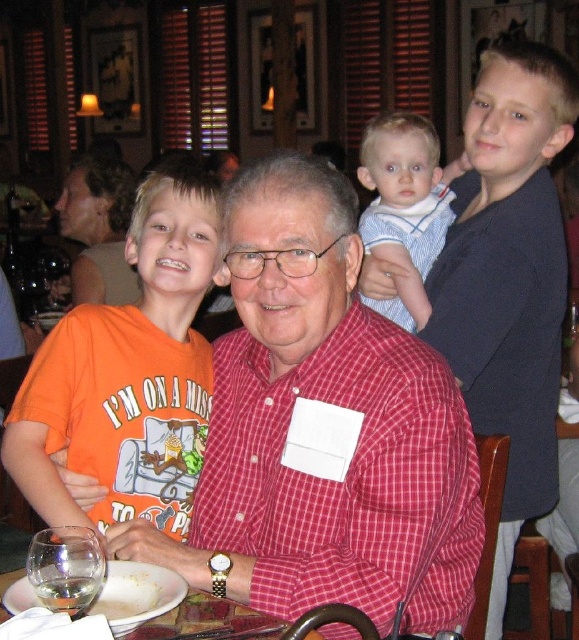
Is point (376, 141) positioned in front of point (53, 593)?

No.

Can you confirm if striped cotton shirt at upper center is wider than clear glass wine glass at lower left?

Yes, striped cotton shirt at upper center is wider than clear glass wine glass at lower left.

Between point (419, 170) and point (64, 602), which one is positioned behind?

The point (419, 170) is behind.

The height and width of the screenshot is (640, 579). In order to click on striped cotton shirt at upper center in this screenshot , I will do `click(404, 209)`.

Does white matte plate at lower left have a lesser width compared to clear glass table at center?

In fact, white matte plate at lower left might be wider than clear glass table at center.

Between white matte plate at lower left and clear glass table at center, which one has less height?

clear glass table at center is shorter.

Who is more forward, (124, 561) or (1, 589)?

Point (1, 589) is more forward.

Where is `white matte plate at lower left`? The width and height of the screenshot is (579, 640). white matte plate at lower left is located at coordinates (137, 593).

Who is higher up, striped cotton shirt at upper center or clear glass table at center?

striped cotton shirt at upper center is above.

From the picture: Which is below, striped cotton shirt at upper center or clear glass table at center?

clear glass table at center

Who is more distant from viewer, [409,202] or [6,588]?

Positioned behind is point [409,202].

The image size is (579, 640). In order to click on striped cotton shirt at upper center in this screenshot , I will do [x=404, y=209].